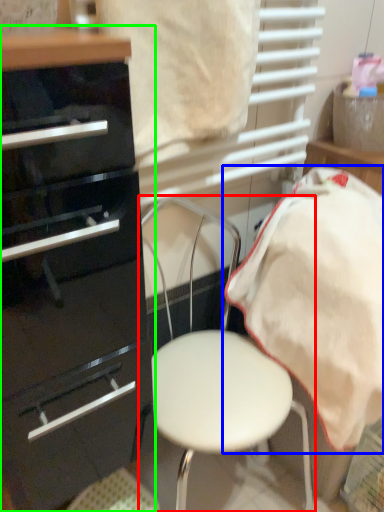
Question: Estimate the real-world distances between objects in this image. Which object is closer to chair (highlighted by a red box), bedding (highlighted by a blue box) or chest of drawers (highlighted by a green box)?

Choices:
 (A) bedding
 (B) chest of drawers

Answer: (A)